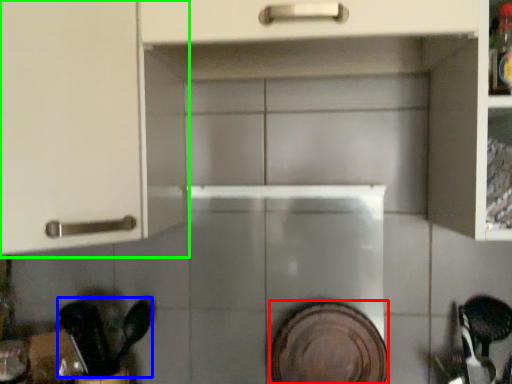
Question: Based on their relative distances, which object is farther from platter (highlighted by a red box)? Choose from tableware (highlighted by a blue box) and cabinetry (highlighted by a green box).

Choices:
 (A) tableware
 (B) cabinetry

Answer: (B)